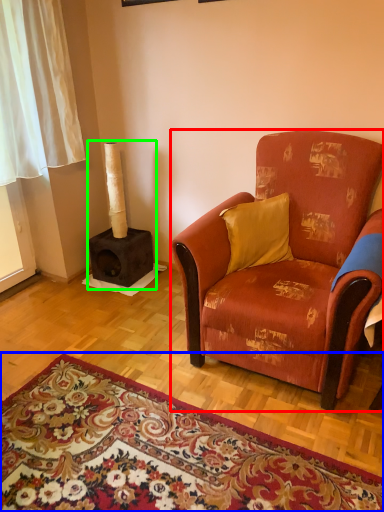
Question: Considering the real-world distances, which object is closest to studio couch (highlighted by a red box)? mat (highlighted by a blue box) or fireplace (highlighted by a green box).

Choices:
 (A) mat
 (B) fireplace

Answer: (A)